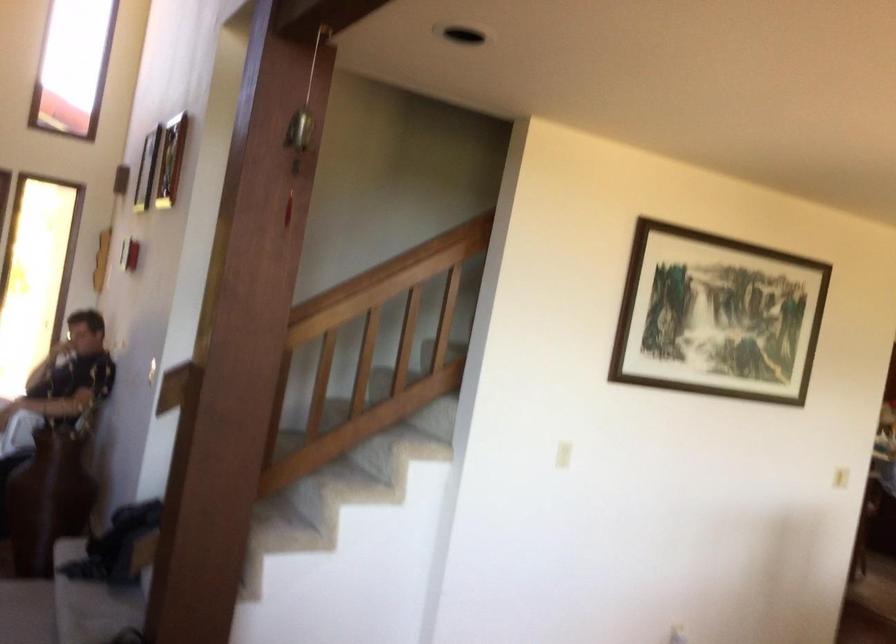
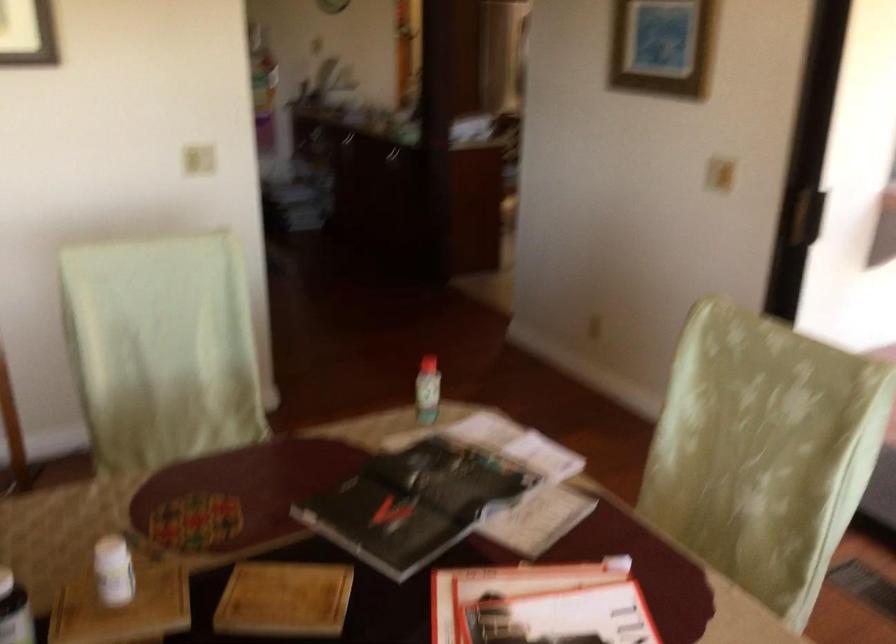
In the scene shown: What movement of the cameraman would produce the second image?

The cameraman moved toward right, forward.